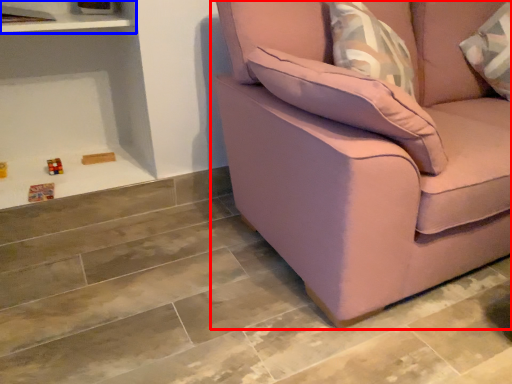
Question: Which of the following is the closest to the observer, studio couch (highlighted by a red box) or shelf (highlighted by a blue box)?

Choices:
 (A) studio couch
 (B) shelf

Answer: (A)